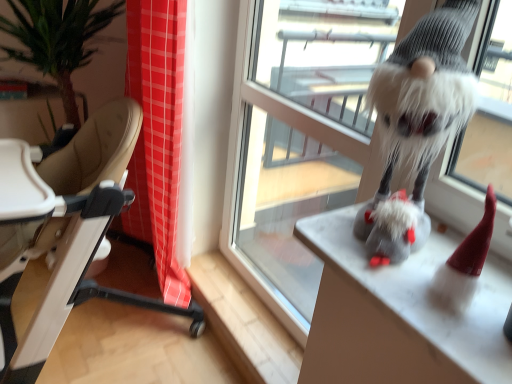
The image size is (512, 384). What are the coordinates of `fuzzy gray gnome at upper right` in the screenshot? It's located at (421, 103).

The image size is (512, 384). Describe the element at coordinates (421, 103) in the screenshot. I see `fuzzy gray gnome at upper right` at that location.

The height and width of the screenshot is (384, 512). Describe the element at coordinates (65, 230) in the screenshot. I see `beige leather highchair at left` at that location.

The image size is (512, 384). I want to click on beige leather highchair at left, so click(x=65, y=230).

At what (x,y) coordinates should I click in order to perform the action: click on transparent glass window at center. Please return your answer as a coordinate pair (x, y). Looking at the image, I should click on (300, 137).

You are a GUI agent. You are given a task and a screenshot of the screen. Output one action in this format:
    pyautogui.click(x=<x>, y=<y>)
    Task: Click on the chair that appears behind the transparent glass window at center
    The width and height of the screenshot is (512, 384).
    Given the screenshot: What is the action you would take?
    pyautogui.click(x=65, y=230)

How different are the orientations of beige leather highchair at left and transparent glass window at center in degrees?

They differ by 0.0284 degrees in their facing directions.

Between point (74, 303) and point (260, 13), which one is positioned behind?

Positioned behind is point (74, 303).

What's the angular difference between beige leather highchair at left and fuzzy gray gnome at upper right's facing directions?

beige leather highchair at left and fuzzy gray gnome at upper right are facing 1.97 degrees away from each other.

Is beige leather highchair at left not near fuzzy gray gnome at upper right?

They are positioned close to each other.

Considering the positions of objects beige leather highchair at left and fuzzy gray gnome at upper right in the image provided, who is more to the left, beige leather highchair at left or fuzzy gray gnome at upper right?

beige leather highchair at left.

Can we say beige leather highchair at left lies outside fuzzy gray gnome at upper right?

beige leather highchair at left is positioned outside fuzzy gray gnome at upper right.

Considering the relative positions of fuzzy gray gnome at right and beige leather highchair at left in the image provided, is fuzzy gray gnome at right to the left or to the right of beige leather highchair at left?

In the image, fuzzy gray gnome at right appears on the right side of beige leather highchair at left.

From the image's perspective, is fuzzy gray gnome at right below beige leather highchair at left?

Yes, from the image's perspective, fuzzy gray gnome at right is below beige leather highchair at left.

Measure the distance between fuzzy gray gnome at right and beige leather highchair at left.

A distance of 33.05 inches exists between fuzzy gray gnome at right and beige leather highchair at left.

In the scene shown: Considering the sizes of objects fuzzy gray gnome at right and beige leather highchair at left in the image provided, who is shorter, fuzzy gray gnome at right or beige leather highchair at left?

With less height is fuzzy gray gnome at right.

Locate an element on the screen. window that is above the fuzzy gray gnome at right (from the image's perspective) is located at coordinates (300, 137).

Is point (268, 42) closer to viewer compared to point (472, 346)?

No, (268, 42) is behind (472, 346).

From the image's perspective, would you say transparent glass window at center is shown under fuzzy gray gnome at right?

Actually, transparent glass window at center appears above fuzzy gray gnome at right in the image.

Between transparent glass window at center and beige leather highchair at left, which one has smaller size?

With smaller size is transparent glass window at center.

Is transparent glass window at center inside the boundaries of beige leather highchair at left, or outside?

transparent glass window at center cannot be found inside beige leather highchair at left.

From a real-world perspective, is transparent glass window at center beneath beige leather highchair at left?

No, from a real-world perspective, transparent glass window at center is not below beige leather highchair at left.

From a real-world perspective, which is physically below, fuzzy gray gnome at upper right or beige leather highchair at left?

beige leather highchair at left, from a real-world perspective.

Is fuzzy gray gnome at upper right positioned behind beige leather highchair at left?

No.

Does fuzzy gray gnome at upper right have a larger size compared to beige leather highchair at left?

No.

Is transparent glass window at center located within fuzzy gray gnome at upper right?

No, fuzzy gray gnome at upper right does not contain transparent glass window at center.

Does point (406, 52) come farther from viewer compared to point (290, 38)?

No, it is in front of (290, 38).

Find the location of a particular element. animal above the transparent glass window at center (from a real-world perspective) is located at coordinates (421, 103).

You are a GUI agent. You are given a task and a screenshot of the screen. Output one action in this format:
    pyautogui.click(x=<x>, y=<y>)
    Task: Click on the chair below the transparent glass window at center (from the image's perspective)
    The height and width of the screenshot is (384, 512).
    Given the screenshot: What is the action you would take?
    pyautogui.click(x=65, y=230)

The height and width of the screenshot is (384, 512). Find the location of `animal lying in front of the beige leather highchair at left`. animal lying in front of the beige leather highchair at left is located at coordinates (421, 103).

From the image, which object appears to be nearer to fuzzy gray gnome at right, beige leather highchair at left or transparent glass window at center?

transparent glass window at center lies closer to fuzzy gray gnome at right than the other object.

Looking at the image, which one is located closer to transparent glass window at center, fuzzy gray gnome at upper right or beige leather highchair at left?

The object closer to transparent glass window at center is fuzzy gray gnome at upper right.

Which object lies nearer to the anchor point beige leather highchair at left, transparent glass window at center or fuzzy gray gnome at upper right?

Among the two, transparent glass window at center is located nearer to beige leather highchair at left.

Estimate the real-world distances between objects in this image. Which object is further from beige leather highchair at left, transparent glass window at center or fuzzy gray gnome at right?

The object further to beige leather highchair at left is fuzzy gray gnome at right.

Which object lies further to the anchor point fuzzy gray gnome at right, transparent glass window at center or fuzzy gray gnome at upper right?

Based on the image, transparent glass window at center appears to be further to fuzzy gray gnome at right.

Estimate the real-world distances between objects in this image. Which object is further from fuzzy gray gnome at right, transparent glass window at center or beige leather highchair at left?

beige leather highchair at left.

Based on their spatial positions, is fuzzy gray gnome at upper right or transparent glass window at center further from fuzzy gray gnome at right?

The object further to fuzzy gray gnome at right is transparent glass window at center.

Looking at this image, estimate the real-world distances between objects in this image. Which object is closer to fuzzy gray gnome at upper right, beige leather highchair at left or fuzzy gray gnome at right?

Among the two, fuzzy gray gnome at right is located nearer to fuzzy gray gnome at upper right.

At what (x,y) coordinates should I click in order to perform the action: click on window situated between beige leather highchair at left and fuzzy gray gnome at upper right from left to right. Please return your answer as a coordinate pair (x, y). The image size is (512, 384). Looking at the image, I should click on (300, 137).

You are a GUI agent. You are given a task and a screenshot of the screen. Output one action in this format:
    pyautogui.click(x=<x>, y=<y>)
    Task: Click on the window between beige leather highchair at left and fuzzy gray gnome at right from left to right
    
    Given the screenshot: What is the action you would take?
    pyautogui.click(x=300, y=137)

Find the location of a particular element. animal between beige leather highchair at left and fuzzy gray gnome at right is located at coordinates (421, 103).

The width and height of the screenshot is (512, 384). In order to click on desk between fuzzy gray gnome at upper right and transparent glass window at center in the front-back direction in this screenshot , I will do `click(400, 314)`.